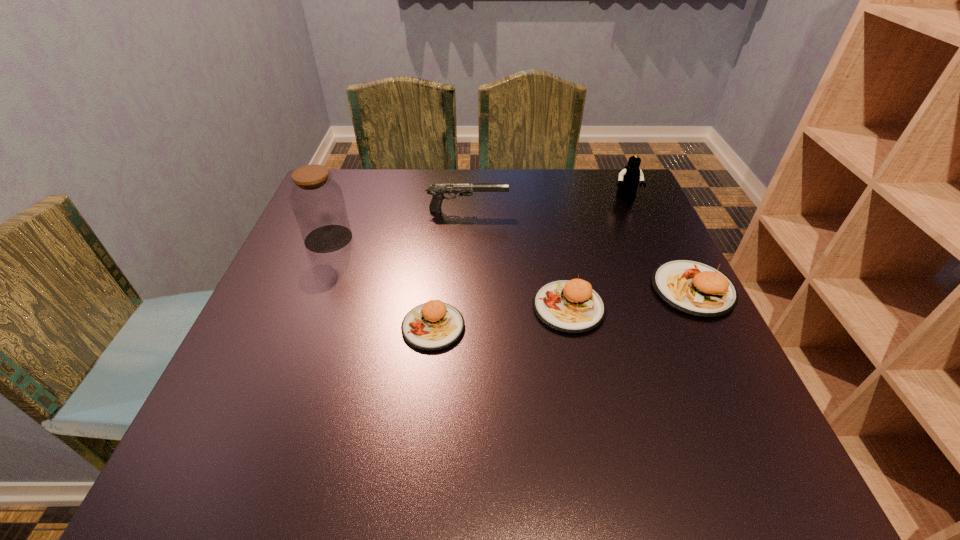
Where is `Lego present at the right edge`? The image size is (960, 540). Lego present at the right edge is located at coordinates (629, 178).

At what (x,y) coordinates should I click in order to perform the action: click on object that is positioned at the far right corner. Please return your answer as a coordinate pair (x, y). The image size is (960, 540). Looking at the image, I should click on (629, 178).

This screenshot has height=540, width=960. Find the location of `vacant space at the far edge of the desktop`. vacant space at the far edge of the desktop is located at coordinates (548, 171).

Image resolution: width=960 pixels, height=540 pixels. I want to click on vacant region at the near edge of the desktop, so click(436, 408).

Locate an element on the screen. Image resolution: width=960 pixels, height=540 pixels. free region at the left edge is located at coordinates (309, 361).

The image size is (960, 540). In order to click on vacant space at the right edge of the desktop in this screenshot , I will do `click(653, 244)`.

Locate an element on the screen. Image resolution: width=960 pixels, height=540 pixels. free space at the near left corner is located at coordinates (255, 391).

At what (x,y) coordinates should I click in order to perform the action: click on vacant area that lies between the gun and the rightmost patty. Please return your answer as a coordinate pair (x, y). Looking at the image, I should click on (580, 250).

Locate an element on the screen. This screenshot has height=540, width=960. vacant area that lies between the Lego and the second shortest patty is located at coordinates (597, 253).

Find the location of a particular element. unoccupied area between the second farthest object and the second patty from right to left is located at coordinates (517, 259).